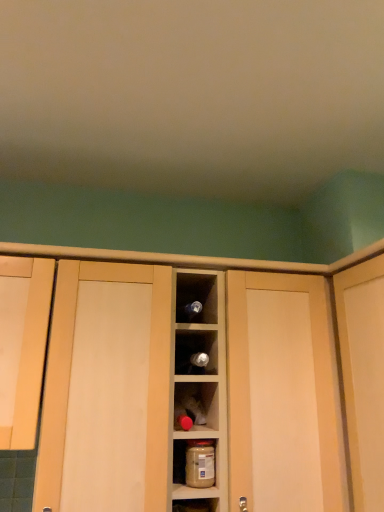
Question: Can you see matte wood door at right touching matte wood cabinet at left, which appears as the 1th cabinetry when viewed from the left?

Choices:
 (A) no
 (B) yes

Answer: (A)

Question: Could you tell me if matte wood door at right is turned towards matte wood cabinet at left, which appears as the 1th cabinetry when viewed from the left?

Choices:
 (A) yes
 (B) no

Answer: (A)

Question: Can you confirm if matte wood door at right is taller than matte wood cabinet at left, which appears as the 1th cabinetry when viewed from the left?

Choices:
 (A) no
 (B) yes

Answer: (B)

Question: From the image's perspective, is matte wood door at right under matte wood cabinet at left, which ranks as the 2th cabinetry in right-to-left order?

Choices:
 (A) yes
 (B) no

Answer: (A)

Question: Is matte wood door at right turned away from matte wood cabinet at left, which ranks as the 2th cabinetry in right-to-left order?

Choices:
 (A) no
 (B) yes

Answer: (A)

Question: In the image, is shiny silver wine bottle at center positioned in front of or behind matte wood cabinet at left, which appears as the 1th cabinetry when viewed from the left?

Choices:
 (A) behind
 (B) front

Answer: (A)

Question: From a real-world perspective, is shiny silver wine bottle at center above or below matte wood cabinet at left, which appears as the 1th cabinetry when viewed from the left?

Choices:
 (A) above
 (B) below

Answer: (B)

Question: In terms of size, does shiny silver wine bottle at center appear bigger or smaller than matte wood cabinet at left, which appears as the 1th cabinetry when viewed from the left?

Choices:
 (A) big
 (B) small

Answer: (B)

Question: From their relative heights in the image, would you say shiny silver wine bottle at center is taller or shorter than matte wood cabinet at left, which appears as the 1th cabinetry when viewed from the left?

Choices:
 (A) short
 (B) tall

Answer: (A)

Question: Is wooden cabinet at center, arranged as the first cabinetry when viewed from the right, to the left or to the right of matte wood cabinet at left, which ranks as the 2th cabinetry in right-to-left order, in the image?

Choices:
 (A) right
 (B) left

Answer: (A)

Question: Looking at the image, does wooden cabinet at center, arranged as the first cabinetry when viewed from the right, seem bigger or smaller compared to matte wood cabinet at left, which appears as the 1th cabinetry when viewed from the left?

Choices:
 (A) big
 (B) small

Answer: (A)

Question: Considering the positions of point (110, 250) and point (23, 305), is point (110, 250) closer or farther from the camera than point (23, 305)?

Choices:
 (A) farther
 (B) closer

Answer: (A)

Question: Is wooden cabinet at center, the 2th cabinetry from the left, inside or outside of matte wood cabinet at left, which ranks as the 2th cabinetry in right-to-left order?

Choices:
 (A) outside
 (B) inside

Answer: (A)

Question: Considering the positions of wooden cabinet at center, the 2th cabinetry from the left, and translucent plastic jar at center in the image, is wooden cabinet at center, the 2th cabinetry from the left, wider or thinner than translucent plastic jar at center?

Choices:
 (A) thin
 (B) wide

Answer: (B)

Question: Would you say wooden cabinet at center, arranged as the first cabinetry when viewed from the right, is inside or outside translucent plastic jar at center?

Choices:
 (A) outside
 (B) inside

Answer: (A)